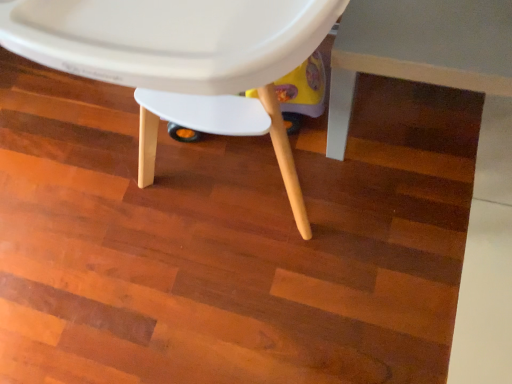
The height and width of the screenshot is (384, 512). What are the coordinates of `vacant space in front of white matte plastic chair at center` in the screenshot? It's located at (302, 287).